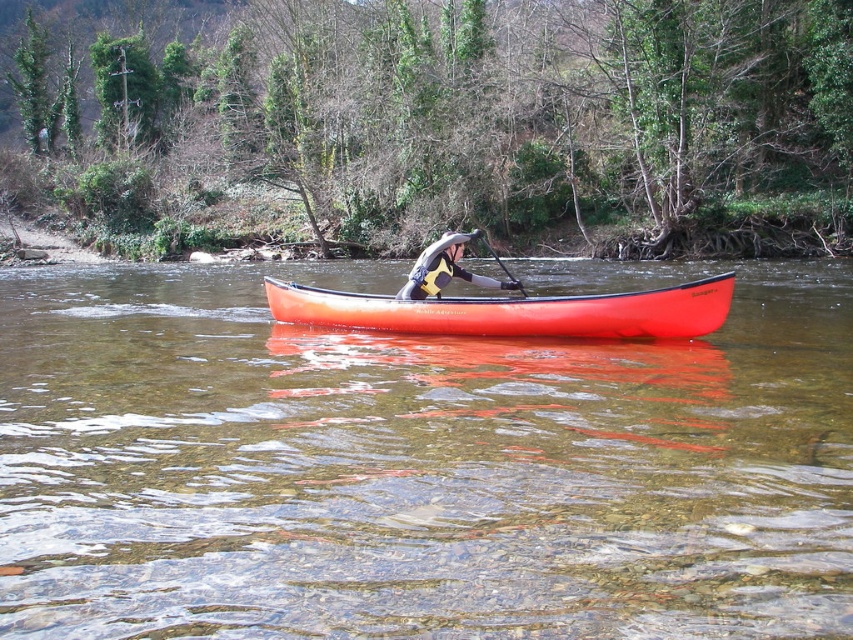
Between point (366, 497) and point (503, 330), which one is positioned in front?

Positioned in front is point (366, 497).

How much distance is there between transparent plastic canoe at center and orange matte canoe at center?

transparent plastic canoe at center and orange matte canoe at center are 20.75 feet apart from each other.

Locate an element on the screen. The image size is (853, 640). transparent plastic canoe at center is located at coordinates (416, 467).

Can you confirm if orange matte canoe at center is shorter than black rubber paddle at center?

Yes, orange matte canoe at center is shorter than black rubber paddle at center.

Which is in front, point (312, 298) or point (494, 253)?

Point (312, 298) is in front.

This screenshot has height=640, width=853. What do you see at coordinates (514, 310) in the screenshot?
I see `orange matte canoe at center` at bounding box center [514, 310].

Image resolution: width=853 pixels, height=640 pixels. What are the coordinates of `orange matte canoe at center` in the screenshot? It's located at (514, 310).

Does point (263, 440) come closer to viewer compared to point (445, 275)?

Yes, it is.

Is transparent plastic canoe at center positioned behind gray neoprene jacket at center?

No, it is not.

Where is `transparent plastic canoe at center`? Image resolution: width=853 pixels, height=640 pixels. transparent plastic canoe at center is located at coordinates (416, 467).